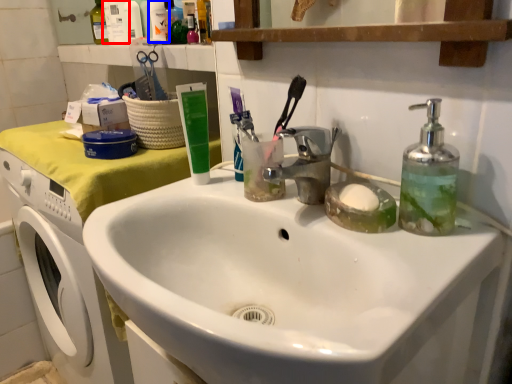
Question: Which object appears closest to the camera in this image, toiletry (highlighted by a red box) or toiletry (highlighted by a blue box)?

Choices:
 (A) toiletry
 (B) toiletry

Answer: (B)